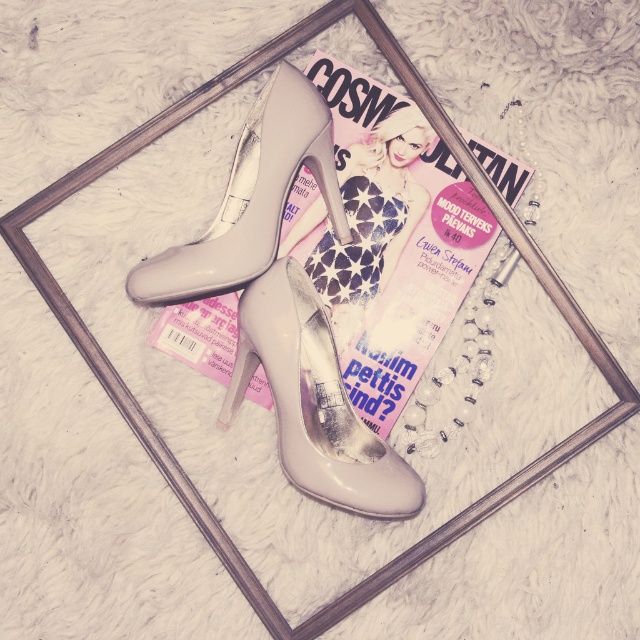
Question: Can you confirm if matte beige high-heeled shoe at center is smaller than matte plastic barbie at center?

Choices:
 (A) yes
 (B) no

Answer: (B)

Question: Estimate the real-world distances between objects in this image. Which object is closer to the pearly white high-heeled shoe at center?

Choices:
 (A) matte pink magazine at center
 (B) matte beige high-heeled shoe at center

Answer: (A)

Question: Which of the following is the farthest from the observer?

Choices:
 (A) pearly white high-heeled shoe at center
 (B) matte pink magazine at center
 (C) matte beige high-heeled shoe at center

Answer: (B)

Question: Observing the image, what is the correct spatial positioning of matte beige high-heeled shoe at center in reference to matte plastic barbie at center?

Choices:
 (A) below
 (B) above

Answer: (B)

Question: Which point is farther to the camera?

Choices:
 (A) (416, 243)
 (B) (410, 156)

Answer: (B)

Question: Observing the image, what is the correct spatial positioning of matte pink magazine at center in reference to pearly white high-heeled shoe at center?

Choices:
 (A) above
 (B) below

Answer: (A)